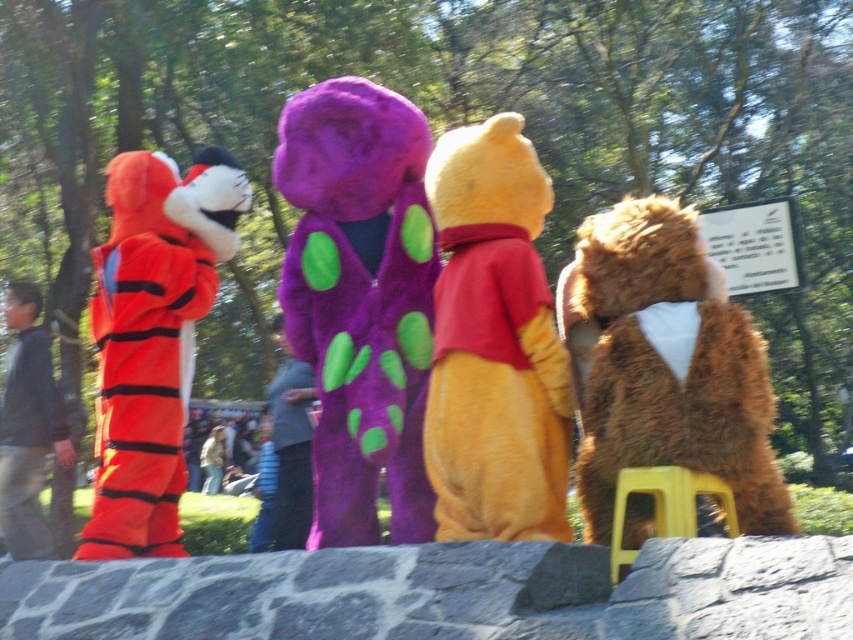
You are trying to decide whether the velvety yellow bear at center can fit through the space between the yellow plastic stool at lower right and the wall. Can it fit?

The velvety yellow bear at center might be wider than yellow plastic stool at lower right, so it might not fit through the space between the yellow plastic stool at lower right and the wall.

In the scene shown: You are a photographer standing in front of the velvety yellow bear at center and the yellow plastic stool at lower right. Which object is closer to you?

The velvety yellow bear at center is closer to you because it is further to the viewer than the yellow plastic stool at lower right.